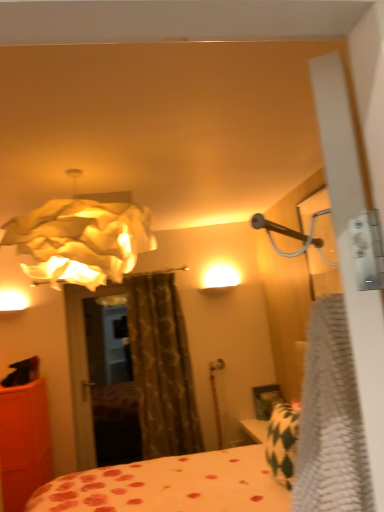
Where is `white textured blanket at right`? This screenshot has height=512, width=384. white textured blanket at right is located at coordinates (331, 420).

Locate an element on the screen. The image size is (384, 512). white paper lampshade at upper left is located at coordinates (81, 241).

The width and height of the screenshot is (384, 512). What do you see at coordinates (171, 485) in the screenshot? I see `polka dot fabric bed at center` at bounding box center [171, 485].

Measure the distance between point [141,308] and camera.

Point [141,308] and camera are 3.90 meters apart.

Identify the location of white textured blanket at right. This screenshot has width=384, height=512. (331, 420).

Considering the sizes of objects orange matte cabinet at left and brown textured curtain at center in the image provided, who is shorter, orange matte cabinet at left or brown textured curtain at center?

orange matte cabinet at left.

Is point (24, 483) farther from camera compared to point (164, 452)?

No.

From the image's perspective, is orange matte cabinet at left under brown textured curtain at center?

Yes.

Which of these two, brown textured curtain at center or orange matte cabinet at left, is smaller?

brown textured curtain at center.

Considering the sizes of objects brown textured curtain at center and orange matte cabinet at left in the image provided, who is shorter, brown textured curtain at center or orange matte cabinet at left?

orange matte cabinet at left is shorter.

Would you say brown textured curtain at center is a long distance from orange matte cabinet at left?

Yes.

How many degrees apart are the facing directions of polka dot fabric bed at center and white textured blanket at right?

polka dot fabric bed at center and white textured blanket at right are facing 3.96 degrees away from each other.

Considering the points (69, 509) and (353, 496), which point is behind, point (69, 509) or point (353, 496)?

Point (69, 509)

Which object is positioned more to the right, polka dot fabric bed at center or white textured blanket at right?

white textured blanket at right is more to the right.

Considering the sizes of polka dot fabric bed at center and white textured blanket at right in the image, is polka dot fabric bed at center wider or thinner than white textured blanket at right?

In the image, polka dot fabric bed at center appears to be wider than white textured blanket at right.

Is orange matte cabinet at left turned away from white paper lampshade at upper left?

No, orange matte cabinet at left's orientation is not away from white paper lampshade at upper left.

From a real-world perspective, is orange matte cabinet at left above or below white paper lampshade at upper left?

orange matte cabinet at left is below white paper lampshade at upper left.

Can we say orange matte cabinet at left lies outside white paper lampshade at upper left?

That's correct, orange matte cabinet at left is outside of white paper lampshade at upper left.

Is orange matte cabinet at left positioned before white paper lampshade at upper left?

No, orange matte cabinet at left is behind white paper lampshade at upper left.

From the image's perspective, is brown textured curtain at center located above or below white paper lampshade at upper left?

From the image's perspective, brown textured curtain at center appears below white paper lampshade at upper left.

Considering the relative positions of brown textured curtain at center and white paper lampshade at upper left in the image provided, is brown textured curtain at center to the right of white paper lampshade at upper left from the viewer's perspective?

Yes, brown textured curtain at center is to the right of white paper lampshade at upper left.

Considering the relative sizes of brown textured curtain at center and white paper lampshade at upper left in the image provided, is brown textured curtain at center thinner than white paper lampshade at upper left?

Indeed, brown textured curtain at center has a lesser width compared to white paper lampshade at upper left.

From a real-world perspective, which is physically below, brown textured curtain at center or white paper lampshade at upper left?

In real-world perspective, brown textured curtain at center is lower.

Is white textured blanket at right facing towards orange matte cabinet at left?

No.

Is white textured blanket at right to the left of orange matte cabinet at left from the viewer's perspective?

No, white textured blanket at right is not to the left of orange matte cabinet at left.

Find the location of a particular element. This screenshot has height=512, width=384. furniture below the white textured blanket at right (from the image's perspective) is located at coordinates (24, 443).

Considering the sizes of objects white textured blanket at right and orange matte cabinet at left in the image provided, who is thinner, white textured blanket at right or orange matte cabinet at left?

white textured blanket at right is thinner.

I want to click on furniture to the left of polka dot fabric bed at center, so click(24, 443).

Between orange matte cabinet at left and polka dot fabric bed at center, which one appears on the right side from the viewer's perspective?

polka dot fabric bed at center is more to the right.

In the image, is orange matte cabinet at left positioned in front of or behind polka dot fabric bed at center?

Clearly, orange matte cabinet at left is behind polka dot fabric bed at center.

Is orange matte cabinet at left taller than polka dot fabric bed at center?

Indeed, orange matte cabinet at left has a greater height compared to polka dot fabric bed at center.

Identify the location of furniture directly beneath the brown textured curtain at center (from a real-world perspective). The image size is (384, 512). (24, 443).

Where is `furniture in front of the brown textured curtain at center`? furniture in front of the brown textured curtain at center is located at coordinates (24, 443).

When comparing their distances from white paper lampshade at upper left, does orange matte cabinet at left or polka dot fabric bed at center seem closer?

The object closer to white paper lampshade at upper left is polka dot fabric bed at center.

Looking at the image, which one is located further to white paper lampshade at upper left, orange matte cabinet at left or white textured blanket at right?

Based on the image, orange matte cabinet at left appears to be further to white paper lampshade at upper left.

When comparing their distances from orange matte cabinet at left, does polka dot fabric bed at center or white paper lampshade at upper left seem closer?

polka dot fabric bed at center.

Looking at the image, which one is located further to white paper lampshade at upper left, orange matte cabinet at left or brown textured curtain at center?

Among the two, brown textured curtain at center is located further to white paper lampshade at upper left.

Based on the photo, looking at the image, which one is located further to polka dot fabric bed at center, orange matte cabinet at left or brown textured curtain at center?

Among the two, brown textured curtain at center is located further to polka dot fabric bed at center.

Based on their spatial positions, is white textured blanket at right or brown textured curtain at center further from orange matte cabinet at left?

white textured blanket at right is further to orange matte cabinet at left.

From the image, which object appears to be farther from brown textured curtain at center, white textured blanket at right or polka dot fabric bed at center?

white textured blanket at right lies further to brown textured curtain at center than the other object.

Estimate the real-world distances between objects in this image. Which object is closer to brown textured curtain at center, polka dot fabric bed at center or white paper lampshade at upper left?

Among the two, polka dot fabric bed at center is located nearer to brown textured curtain at center.

Image resolution: width=384 pixels, height=512 pixels. Find the location of `lamp located between polka dot fabric bed at center and brown textured curtain at center in the depth direction`. lamp located between polka dot fabric bed at center and brown textured curtain at center in the depth direction is located at coordinates (81, 241).

The width and height of the screenshot is (384, 512). What are the coordinates of `furniture between white paper lampshade at upper left and brown textured curtain at center from front to back` in the screenshot? It's located at (24, 443).

What are the coordinates of `furniture located between polka dot fabric bed at center and brown textured curtain at center in the depth direction` in the screenshot? It's located at (24, 443).

Identify the location of bed between white paper lampshade at upper left and orange matte cabinet at left vertically. The height and width of the screenshot is (512, 384). (171, 485).